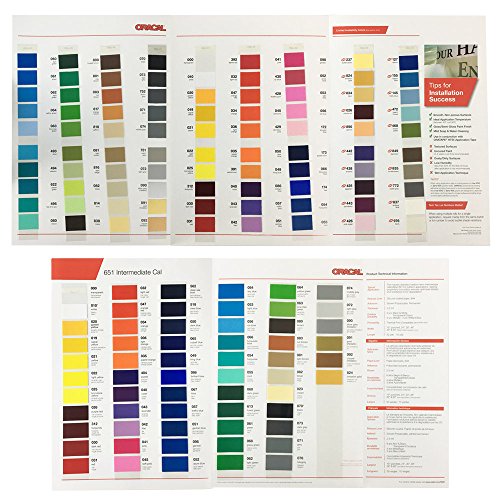
Locate an element on the screen. This screenshot has width=500, height=500. sheets is located at coordinates (242, 154), (240, 393).